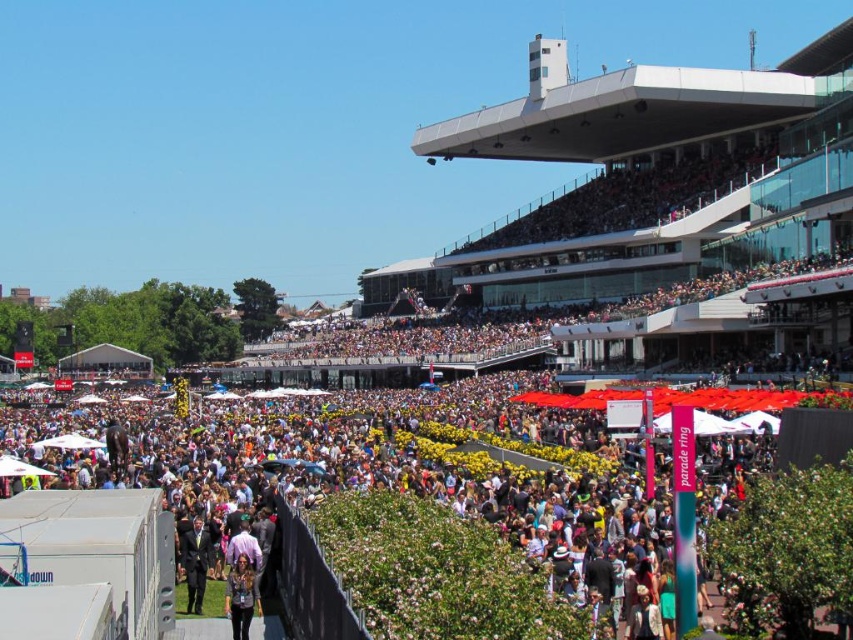
Question: Is black suit at center positioned at the back of matte black jacket at lower center?

Choices:
 (A) yes
 (B) no

Answer: (A)

Question: Observing the image, what is the correct spatial positioning of black suit at center in reference to matte black jacket at lower center?

Choices:
 (A) right
 (B) left

Answer: (B)

Question: Among these points, which one is farthest from the camera?

Choices:
 (A) (227, 612)
 (B) (200, 529)

Answer: (B)

Question: Is black suit at center thinner than matte black jacket at lower center?

Choices:
 (A) no
 (B) yes

Answer: (A)

Question: Which point appears farthest from the camera in this image?

Choices:
 (A) (245, 579)
 (B) (184, 548)

Answer: (B)